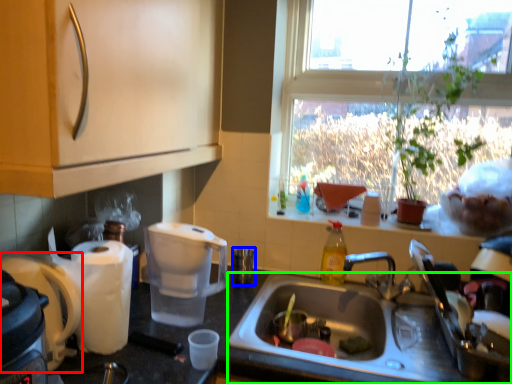
Question: Considering the real-world distances, which object is closest to coffee maker (highlighted by a red box)? coffee cup (highlighted by a blue box) or sink (highlighted by a green box).

Choices:
 (A) coffee cup
 (B) sink

Answer: (B)